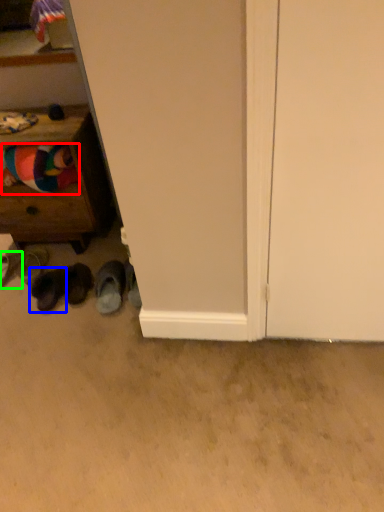
Question: Which object is positioned farthest from clothing (highlighted by a red box)? Select from footwear (highlighted by a blue box) and footwear (highlighted by a green box).

Choices:
 (A) footwear
 (B) footwear

Answer: (B)